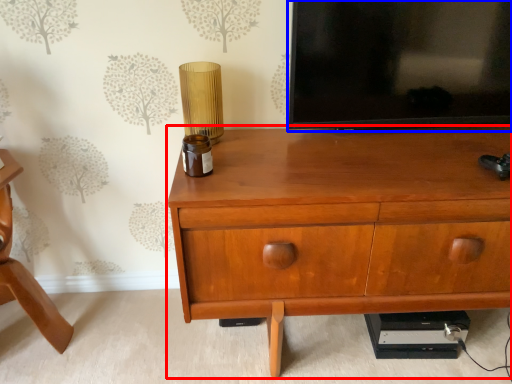
Question: Which object appears farthest to the camera in this image, chest of drawers (highlighted by a red box) or television (highlighted by a blue box)?

Choices:
 (A) chest of drawers
 (B) television

Answer: (B)